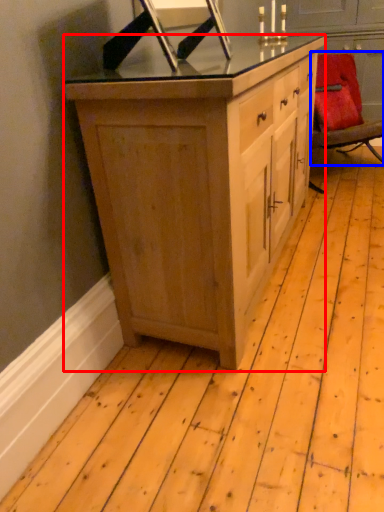
Question: Which of the following is the farthest to the observer, cabinetry (highlighted by a red box) or chair (highlighted by a blue box)?

Choices:
 (A) cabinetry
 (B) chair

Answer: (B)